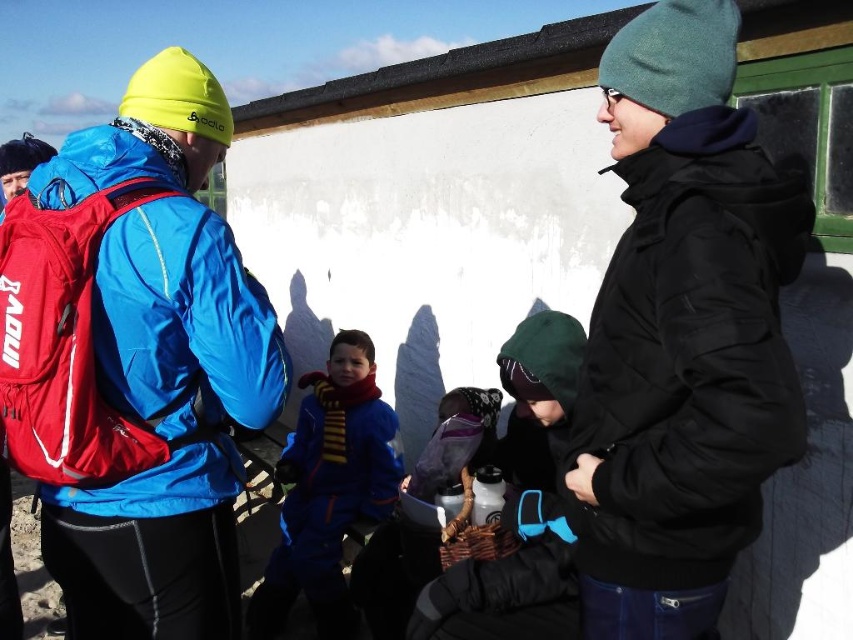
From the picture: You are a photographer trying to capture a group photo of the black matte jacket at right and the velvet purple scarf at center. Since you want both subjects to appear equally sized in the photo, which subject should you move closer to the camera?

The black matte jacket at right should be moved closer to the camera because its width is less than the velvet purple scarf at center, so moving it closer will make it appear larger in the photo and balance their sizes.